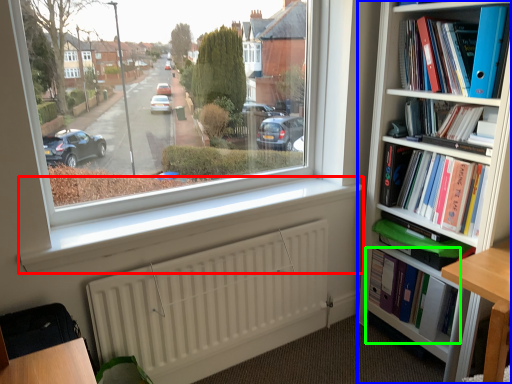
Question: Which object is the closest to the window sill (highlighted by a red box)? Choose among these: bookcase (highlighted by a blue box) or book (highlighted by a green box).

Choices:
 (A) bookcase
 (B) book

Answer: (A)